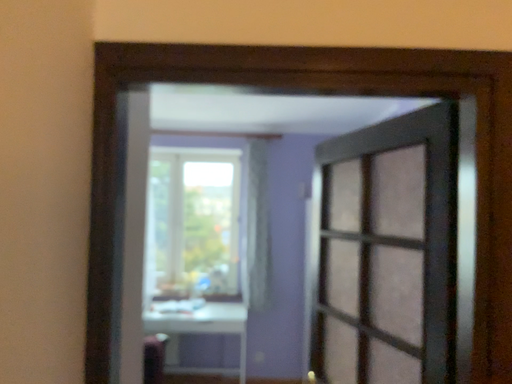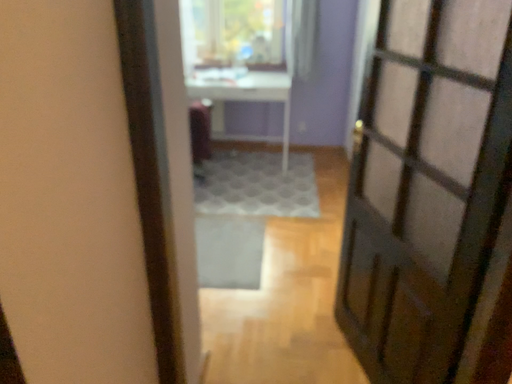
Question: How did the camera likely rotate when shooting the video?

Choices:
 (A) rotated right
 (B) rotated left

Answer: (B)